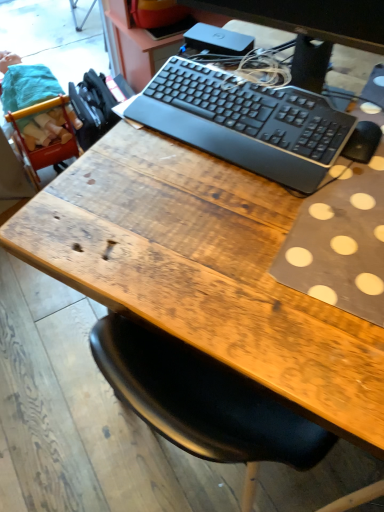
Question: Is black plastic keyboard at upper center further to camera compared to black plastic keyboard at center?

Choices:
 (A) yes
 (B) no

Answer: (B)

Question: Could you tell me if black plastic keyboard at upper center is facing black plastic keyboard at center?

Choices:
 (A) no
 (B) yes

Answer: (B)

Question: Considering the relative sizes of black plastic keyboard at upper center and black plastic keyboard at center in the image provided, is black plastic keyboard at upper center bigger than black plastic keyboard at center?

Choices:
 (A) no
 (B) yes

Answer: (B)

Question: From a real-world perspective, is black plastic keyboard at upper center positioned over black plastic keyboard at center based on gravity?

Choices:
 (A) no
 (B) yes

Answer: (B)

Question: Would you say black plastic keyboard at upper center is outside black plastic keyboard at center?

Choices:
 (A) yes
 (B) no

Answer: (A)

Question: Considering the relative sizes of black plastic keyboard at upper center and black plastic keyboard at center in the image provided, is black plastic keyboard at upper center taller than black plastic keyboard at center?

Choices:
 (A) yes
 (B) no

Answer: (A)

Question: Does black plastic keyboard at center have a smaller size compared to black plastic keyboard at upper center?

Choices:
 (A) yes
 (B) no

Answer: (A)

Question: Is black plastic keyboard at center not within black plastic keyboard at upper center?

Choices:
 (A) yes
 (B) no

Answer: (A)

Question: Is black plastic keyboard at center not near black plastic keyboard at upper center?

Choices:
 (A) yes
 (B) no

Answer: (B)

Question: Can you confirm if black plastic keyboard at center is taller than black plastic keyboard at upper center?

Choices:
 (A) yes
 (B) no

Answer: (B)

Question: Considering the relative positions of black plastic keyboard at center and black plastic keyboard at upper center in the image provided, is black plastic keyboard at center to the right of black plastic keyboard at upper center from the viewer's perspective?

Choices:
 (A) yes
 (B) no

Answer: (B)

Question: Is black plastic keyboard at center surrounding black plastic keyboard at upper center?

Choices:
 (A) yes
 (B) no

Answer: (B)

Question: In terms of height, does black plastic keyboard at upper center look taller or shorter compared to black plastic keyboard at center?

Choices:
 (A) tall
 (B) short

Answer: (A)